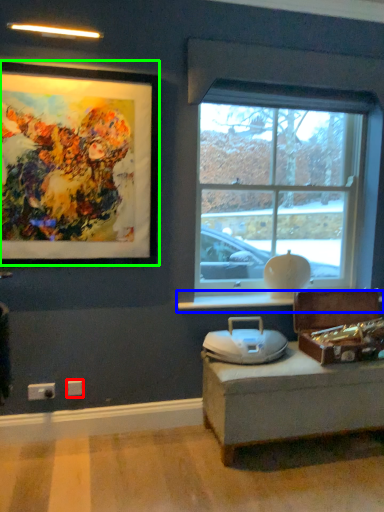
Question: Which is farther away from electric outlet (highlighted by a red box)? window sill (highlighted by a blue box) or picture frame (highlighted by a green box)?

Choices:
 (A) window sill
 (B) picture frame

Answer: (B)